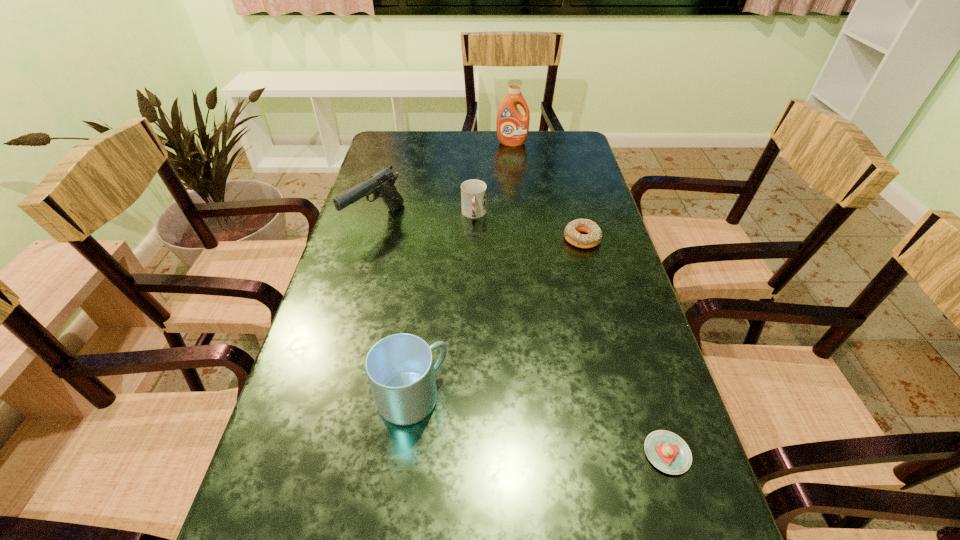
The width and height of the screenshot is (960, 540). I want to click on free space that is in between the gun and the third object from left to right, so click(424, 218).

I want to click on empty space that is in between the gun and the tallest object, so click(x=444, y=183).

Image resolution: width=960 pixels, height=540 pixels. What are the coordinates of `free space between the leftmost object and the tallest object` in the screenshot? It's located at pos(444,183).

At what (x,y) coordinates should I click in order to perform the action: click on vacant space that is in between the fourth tallest object and the fifth tallest object. Please return your answer as a coordinate pair (x, y). This screenshot has height=540, width=960. Looking at the image, I should click on (528, 227).

Point out which object is positioned as the fourth nearest to the second object from left to right. Please provide its 2D coordinates. Your answer should be formatted as a tuple, i.e. [(x, y)], where the tuple contains the x and y coordinates of a point satisfying the conditions above.

[(473, 192)]

You are a GUI agent. You are given a task and a screenshot of the screen. Output one action in this format:
    pyautogui.click(x=<x>, y=<y>)
    Task: Click on the object that can be found as the closest to the second nearest object
    
    Given the screenshot: What is the action you would take?
    pyautogui.click(x=668, y=452)

The height and width of the screenshot is (540, 960). I want to click on vacant space that satisfies the following two spatial constraints: 1. at the muzzle of the gun; 2. on the right side of the second shortest object, so click(371, 239).

At what (x,y) coordinates should I click in order to perform the action: click on free space that satisfies the following two spatial constraints: 1. at the muzzle of the leftmost object; 2. on the right side of the mug. Please return your answer as a coordinate pair (x, y). Looking at the image, I should click on (325, 397).

Where is `vacant space that satisfies the following two spatial constraints: 1. on the front-facing side of the tallest object; 2. on the right side of the doughnut`? vacant space that satisfies the following two spatial constraints: 1. on the front-facing side of the tallest object; 2. on the right side of the doughnut is located at coordinates (522, 239).

At what (x,y) coordinates should I click in order to perform the action: click on vacant space that satisfies the following two spatial constraints: 1. at the muzzle of the fifth object from right to left; 2. on the left side of the gun. Please return your answer as a coordinate pair (x, y). Image resolution: width=960 pixels, height=540 pixels. Looking at the image, I should click on tap(325, 397).